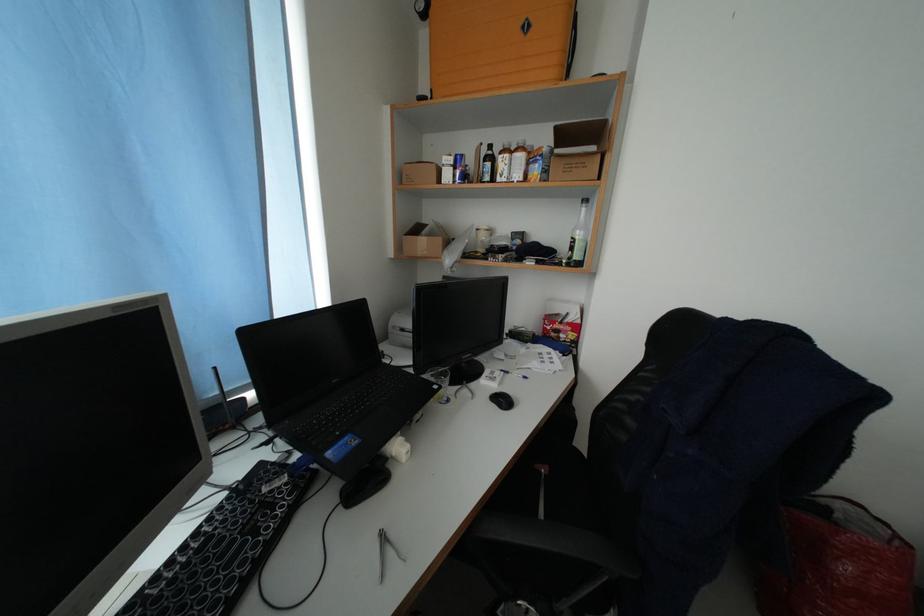
The location [563,321] corresponds to which object?

It corresponds to the red and white box in the image.